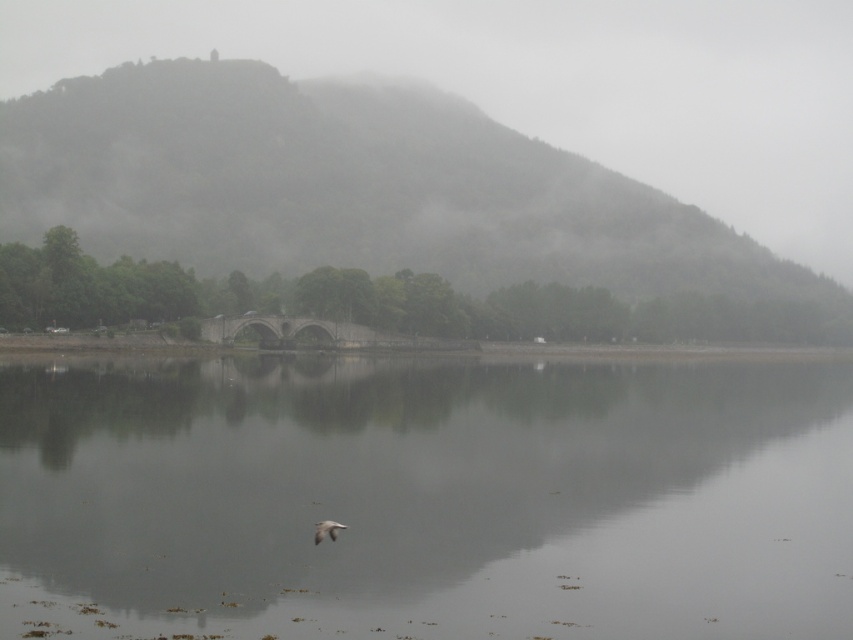
You are standing at the edge of the smooth gray water at center and want to observe the white feathered bird at lower center. Which direction should you look to see the bird?

The white feathered bird at lower center is further away from the viewer than the smooth gray water at center. Therefore, you should look upward to see the bird since it is positioned behind the water.

You are a hiker trying to reach the stone bridge in the midground of the image. You are currently standing at point [354,189] on the foggy green hillside at upper center. Which direction should you head to reach the stone bridge?

The point [354,189] is located on the foggy green hillside at upper center, so to reach the stone bridge in the midground, you should head downward from the upper center towards the bridge.

Based on the photo, you are a photographer trying to capture the reflection of the white feathered bird at lower center in the smooth gray water at center. Since the water is still, will the bird be clearly visible in the water?

The smooth gray water at center is bigger than the white feathered bird at lower center, so the bird will be clearly visible in the water as the water surface is large enough to reflect the bird.